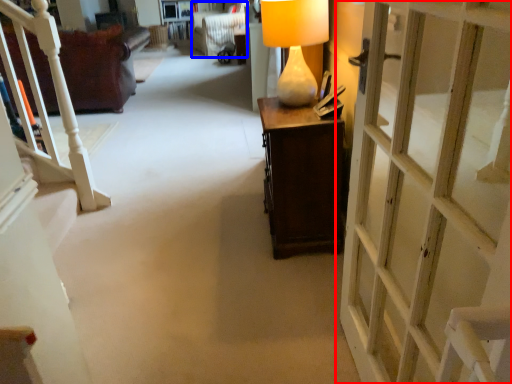
Question: Which of the following is the farthest to the observer, door (highlighted by a red box) or armchair (highlighted by a blue box)?

Choices:
 (A) door
 (B) armchair

Answer: (B)